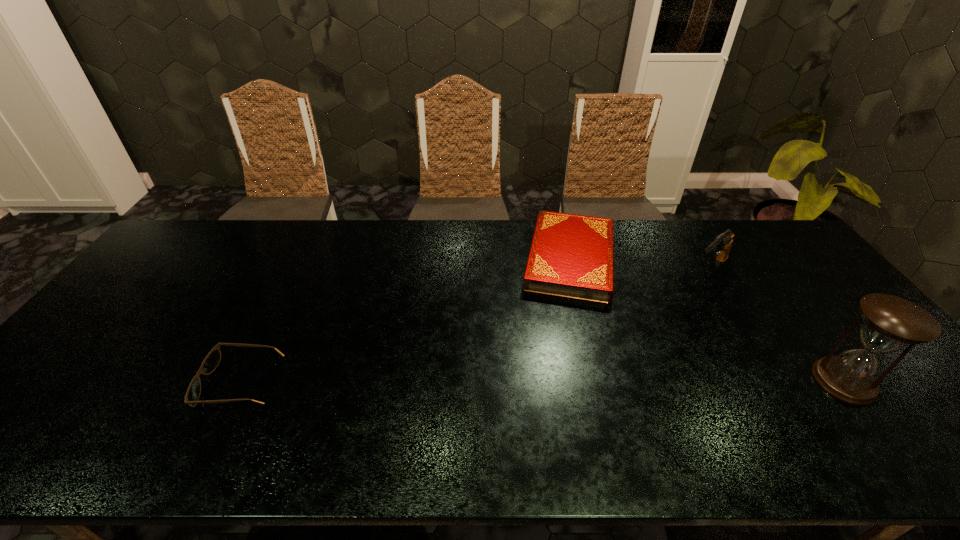
I want to click on vacant space located 0.210m along the barrel of the gun, so click(x=658, y=313).

You are a GUI agent. You are given a task and a screenshot of the screen. Output one action in this format:
    pyautogui.click(x=<x>, y=<y>)
    Task: Click on the free space located 0.360m along the barrel of the gun
    
    Given the screenshot: What is the action you would take?
    pyautogui.click(x=627, y=340)

At what (x,y) coordinates should I click in order to perform the action: click on free spot located along the barrel of the gun. Please return your answer as a coordinate pair (x, y). Looking at the image, I should click on (618, 348).

Where is `free region located on the cover of the hardback book`? The width and height of the screenshot is (960, 540). free region located on the cover of the hardback book is located at coordinates (562, 375).

What are the coordinates of `vacant point located on the cover of the hardback book` in the screenshot? It's located at (559, 402).

You are a GUI agent. You are given a task and a screenshot of the screen. Output one action in this format:
    pyautogui.click(x=<x>, y=<y>)
    Task: Click on the vacant space located on the cover of the hardback book
    The image size is (960, 540).
    Given the screenshot: What is the action you would take?
    pyautogui.click(x=560, y=388)

Where is `gun that is at the far edge`? The width and height of the screenshot is (960, 540). gun that is at the far edge is located at coordinates (722, 244).

This screenshot has height=540, width=960. Find the location of `hardback book at the far edge`. hardback book at the far edge is located at coordinates tap(571, 256).

Locate an element on the screen. sunglasses that is at the near edge is located at coordinates (212, 360).

You are a GUI agent. You are given a task and a screenshot of the screen. Output one action in this format:
    pyautogui.click(x=<x>, y=<y>)
    Task: Click on the hourglass that is at the near edge
    
    Given the screenshot: What is the action you would take?
    pyautogui.click(x=890, y=323)